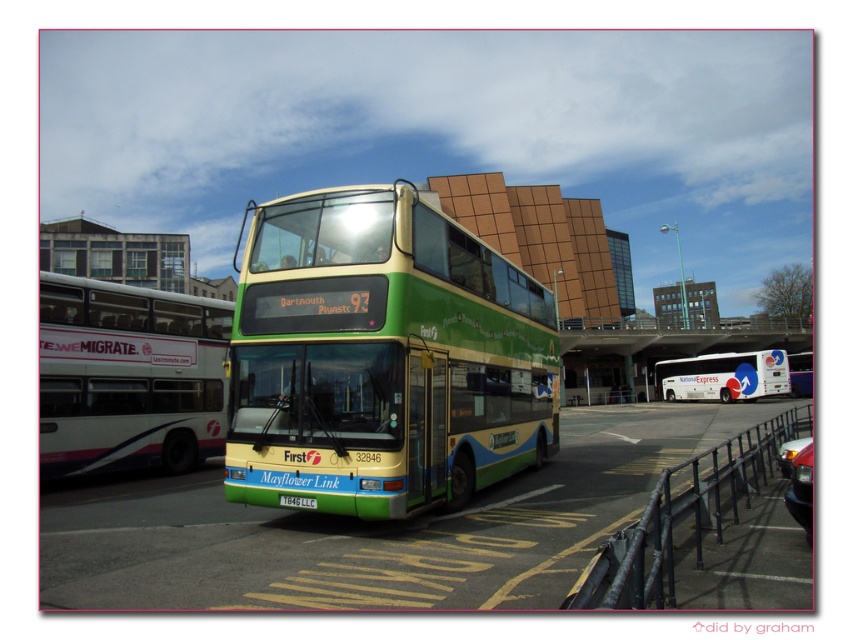
Question: Is green matte/deck bus at center thinner than white glossy bus at left?

Choices:
 (A) no
 (B) yes

Answer: (A)

Question: Which of the following is the farthest from the observer?

Choices:
 (A) (548, 310)
 (B) (521, 564)
 (C) (303, 500)
 (D) (733, 376)

Answer: (D)

Question: Which point is closer to the camera?

Choices:
 (A) (712, 436)
 (B) (660, 394)
 (C) (320, 452)

Answer: (C)

Question: Can you confirm if green matte/deck bus at center is positioned below white glossy bus at left?

Choices:
 (A) no
 (B) yes

Answer: (B)

Question: Can you confirm if white glossy bus at left is positioned to the right of green plastic license plate at center?

Choices:
 (A) yes
 (B) no

Answer: (B)

Question: Based on their relative distances, which object is nearer to the green rubber bus at center?

Choices:
 (A) green plastic license plate at center
 (B) green matte/deck bus at center

Answer: (B)